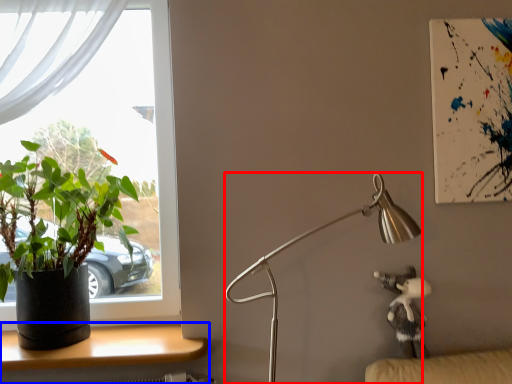
Question: Which of the following is the farthest to the observer, lamp (highlighted by a red box) or desk (highlighted by a blue box)?

Choices:
 (A) lamp
 (B) desk

Answer: (B)